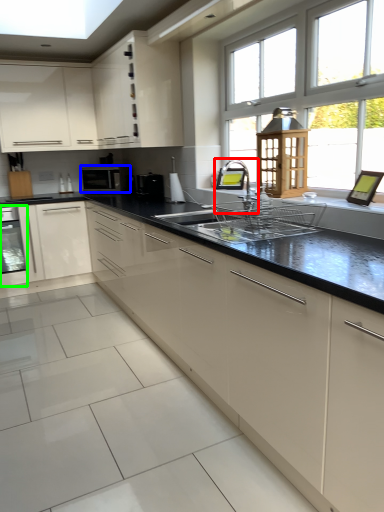
Question: Which is farther away from faucet (highlighted by a red box)? kitchen appliance (highlighted by a blue box) or home appliance (highlighted by a green box)?

Choices:
 (A) kitchen appliance
 (B) home appliance

Answer: (B)